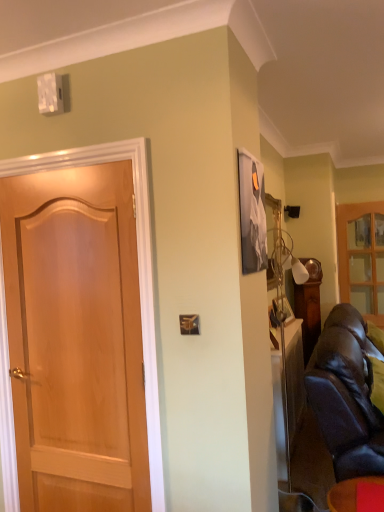
Question: Is matte black leather couch at lower right not within leather couch at right?

Choices:
 (A) yes
 (B) no

Answer: (A)

Question: Considering the relative positions of matte black leather couch at lower right and leather couch at right in the image provided, is matte black leather couch at lower right to the left of leather couch at right from the viewer's perspective?

Choices:
 (A) no
 (B) yes

Answer: (B)

Question: Can you confirm if matte black leather couch at lower right is taller than leather couch at right?

Choices:
 (A) yes
 (B) no

Answer: (B)

Question: Is leather couch at right at the back of matte black leather couch at lower right?

Choices:
 (A) no
 (B) yes

Answer: (B)

Question: Considering the relative sizes of matte black leather couch at lower right and leather couch at right in the image provided, is matte black leather couch at lower right wider than leather couch at right?

Choices:
 (A) no
 (B) yes

Answer: (A)

Question: Is matte black leather couch at lower right touching leather couch at right?

Choices:
 (A) no
 (B) yes

Answer: (A)

Question: Is leather couch at right located within wooden glass cabinet at right?

Choices:
 (A) no
 (B) yes

Answer: (A)

Question: Considering the relative sizes of wooden glass cabinet at right and leather couch at right in the image provided, is wooden glass cabinet at right bigger than leather couch at right?

Choices:
 (A) yes
 (B) no

Answer: (B)

Question: From the image's perspective, is wooden glass cabinet at right on top of leather couch at right?

Choices:
 (A) no
 (B) yes

Answer: (B)

Question: Considering the relative sizes of wooden glass cabinet at right and leather couch at right in the image provided, is wooden glass cabinet at right wider than leather couch at right?

Choices:
 (A) yes
 (B) no

Answer: (B)

Question: Is wooden glass cabinet at right located outside leather couch at right?

Choices:
 (A) no
 (B) yes

Answer: (B)

Question: Is wooden glass cabinet at right facing towards leather couch at right?

Choices:
 (A) no
 (B) yes

Answer: (B)

Question: Does leather couch at right have a greater height compared to matte black leather couch at lower right?

Choices:
 (A) no
 (B) yes

Answer: (B)